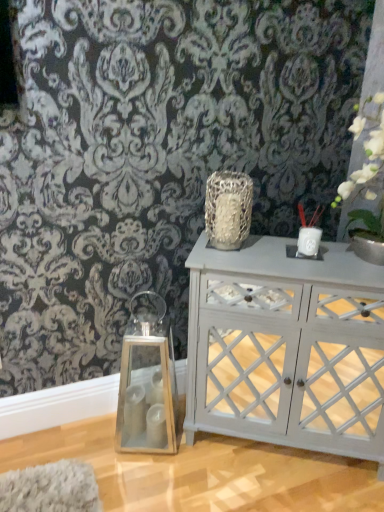
In order to click on vacant space to the right of textured silver vase at center in this screenshot , I will do `click(268, 253)`.